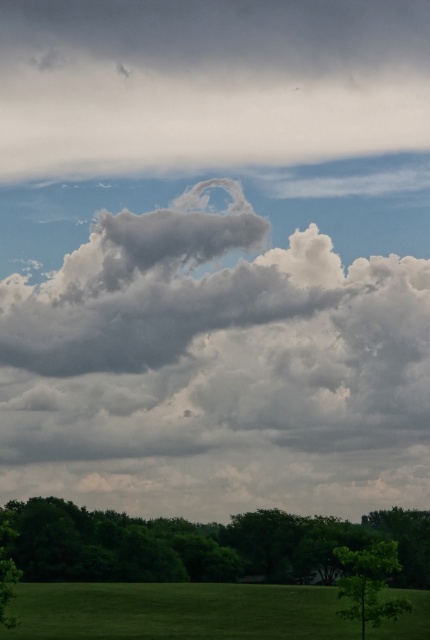
Looking at this image, you are a photographer planning to capture the entire gray fluffy cloud at upper center and green grass at bottom in one frame. Based on the scene, which of these two elements will occupy more horizontal space in your photo?

The gray fluffy cloud at upper center will occupy more horizontal space in the photo since its width surpasses that of the green grass at bottom.

You are standing in the field and want to take a photo of the green leafy tree at lower center. However, the gray fluffy cloud at upper center is blocking your view. Can you move to a position where the tree is visible without the cloud blocking it?

The green leafy tree at lower center is behind the gray fluffy cloud at upper center, so moving closer to the tree might allow you to see it without the cloud blocking the view.

You are an astronomer analyzing the image. The gray fluffy cloud at upper center is part of your study. What is its exact 2D coordinate in the image?

The gray fluffy cloud at upper center is located at the 2D coordinate point of (206, 84).